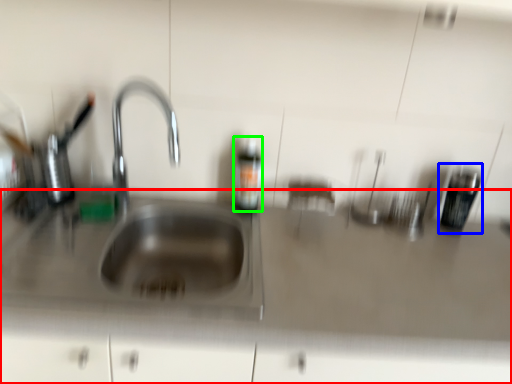
Question: Estimate the real-world distances between objects in this image. Which object is farther from counter top (highlighted by a red box), appliance (highlighted by a blue box) or bottle (highlighted by a green box)?

Choices:
 (A) appliance
 (B) bottle

Answer: (A)